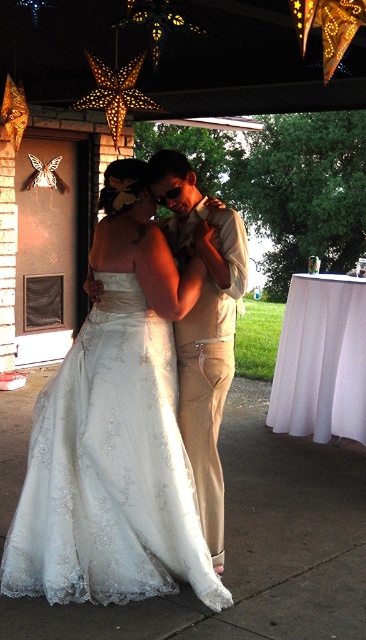
Question: Which of the following is the closest to the observer?

Choices:
 (A) white satin dress at center
 (B) tan fabric pants at center

Answer: (A)

Question: Can you confirm if white satin dress at center is positioned above tan fabric pants at center?

Choices:
 (A) yes
 (B) no

Answer: (B)

Question: Is white satin dress at center thinner than tan fabric pants at center?

Choices:
 (A) yes
 (B) no

Answer: (B)

Question: Which of the following is the farthest from the observer?

Choices:
 (A) (58, 420)
 (B) (177, 220)

Answer: (B)

Question: Is white satin dress at center positioned behind tan fabric pants at center?

Choices:
 (A) yes
 (B) no

Answer: (B)